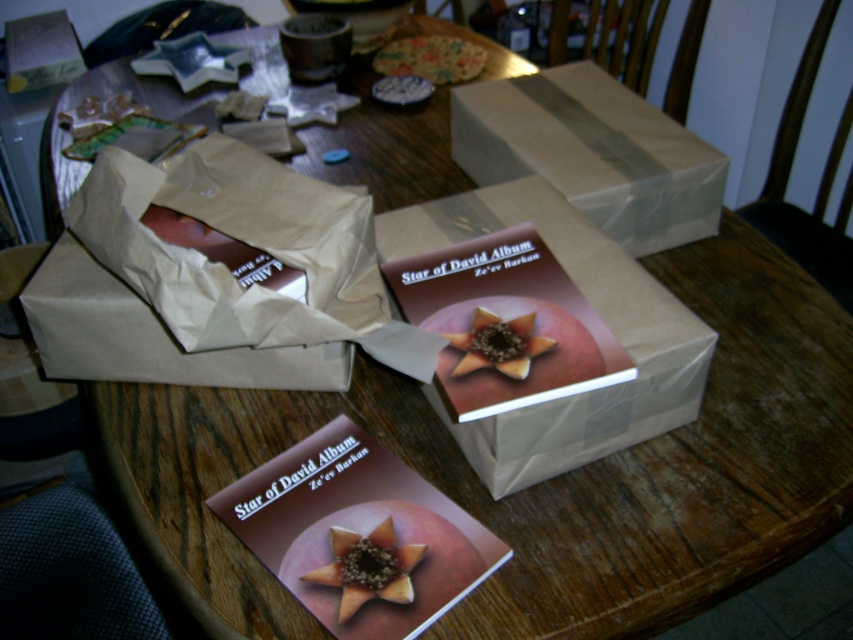
Between white paper box at upper center and matte brown flower at center, which one appears on the left side from the viewer's perspective?

From the viewer's perspective, matte brown flower at center appears more on the left side.

Which is below, white paper box at upper center or matte brown flower at center?

matte brown flower at center is below.

I want to click on white paper box at upper center, so click(x=592, y=152).

Locate an element on the screen. brown paper bag at center is located at coordinates coord(215,280).

Does brown paper bag at center have a lesser width compared to matte brown book at center?

In fact, brown paper bag at center might be wider than matte brown book at center.

This screenshot has width=853, height=640. What do you see at coordinates (215, 280) in the screenshot?
I see `brown paper bag at center` at bounding box center [215, 280].

Where is `brown paper bag at center`? Image resolution: width=853 pixels, height=640 pixels. brown paper bag at center is located at coordinates (215, 280).

Who is more forward, (125, 196) or (630, 198)?

Point (125, 196)

The width and height of the screenshot is (853, 640). In order to click on brown paper bag at center in this screenshot , I will do `click(215, 280)`.

Does point (126, 353) come behind point (611, 109)?

No.

Where is `brown paper bag at center`? Image resolution: width=853 pixels, height=640 pixels. brown paper bag at center is located at coordinates (215, 280).